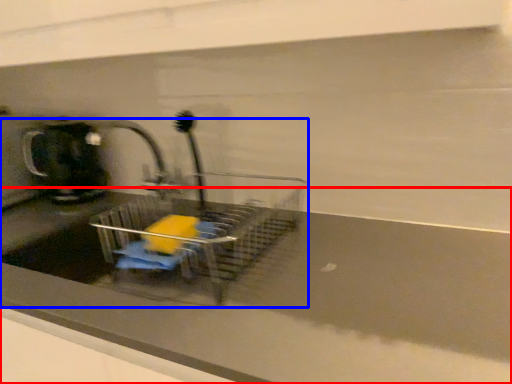
Question: Which of the following is the farthest to the observer, counter top (highlighted by a red box) or sink (highlighted by a blue box)?

Choices:
 (A) counter top
 (B) sink

Answer: (B)